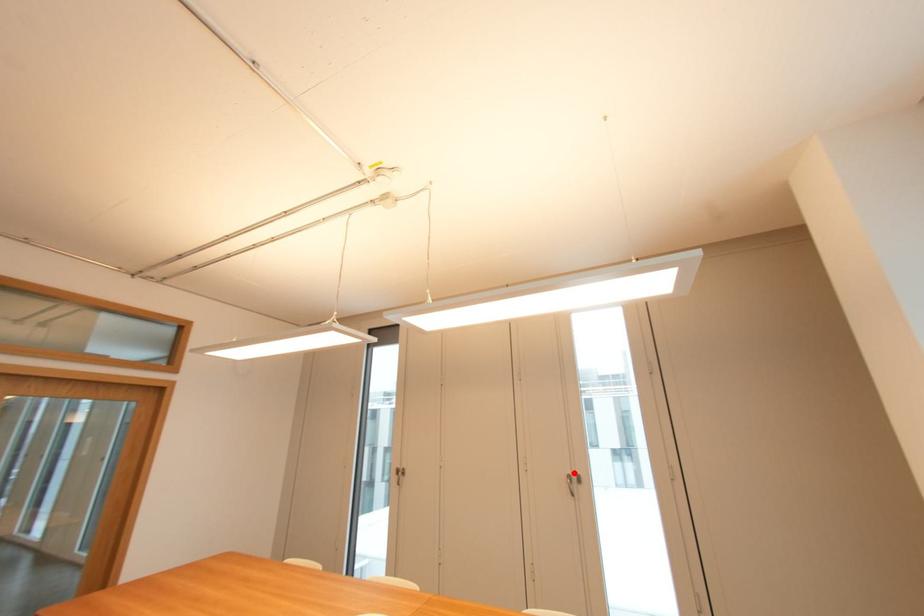
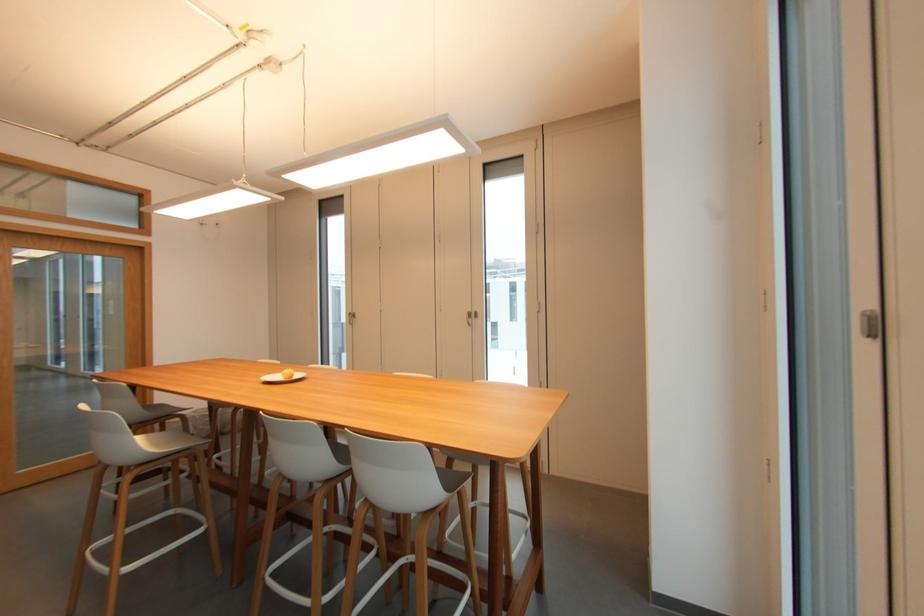
Where in the second image is the point corresponding to the highlighted location from the first image?

(473, 310)